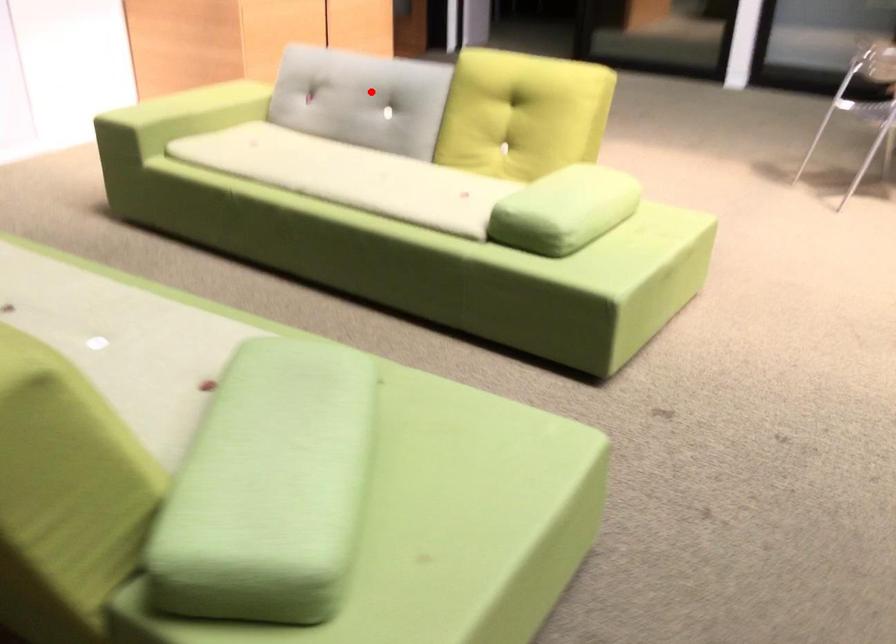
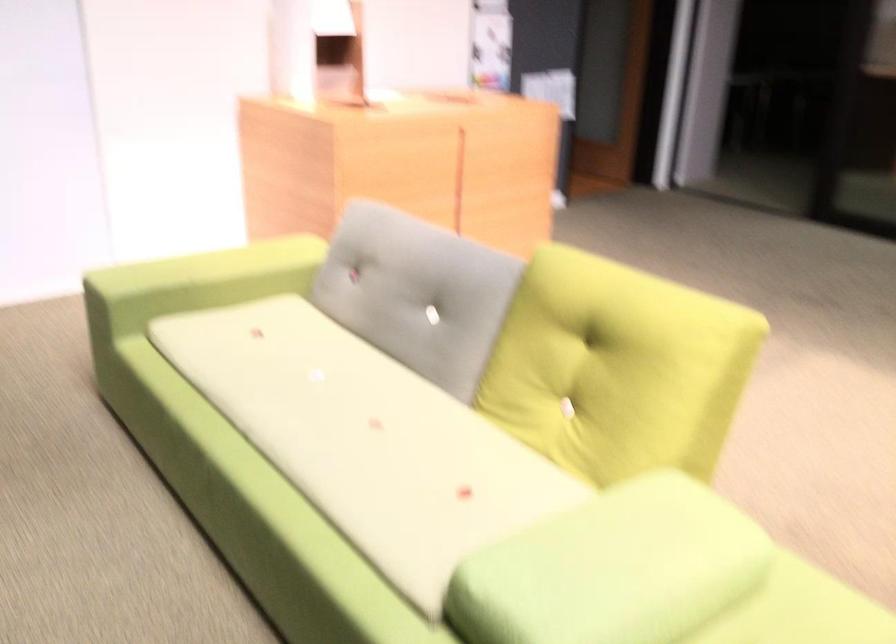
Where in the second image is the point corresponding to the highlighted location from the first image?

(417, 292)